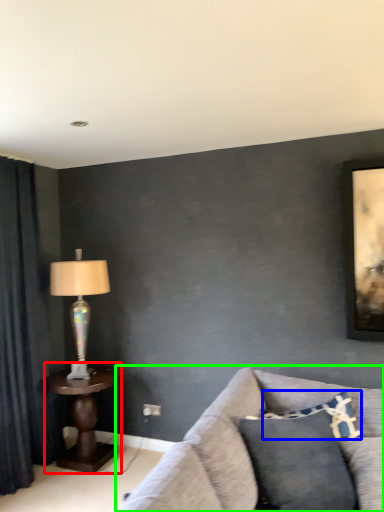
Question: Based on their relative distances, which object is farther from table (highlighted by a red box)? Choose from pillow (highlighted by a blue box) and studio couch (highlighted by a green box).

Choices:
 (A) pillow
 (B) studio couch

Answer: (A)